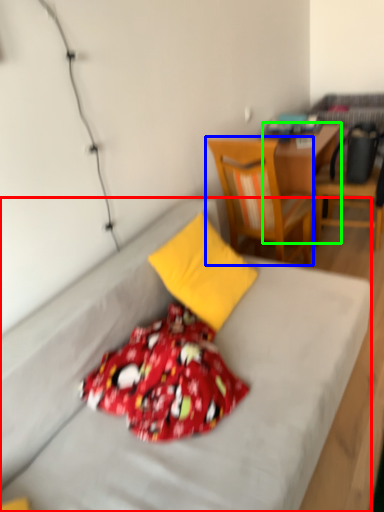
Question: Considering the real-world distances, which object is closest to bed (highlighted by a red box)? chair (highlighted by a blue box) or desk (highlighted by a green box).

Choices:
 (A) chair
 (B) desk

Answer: (A)